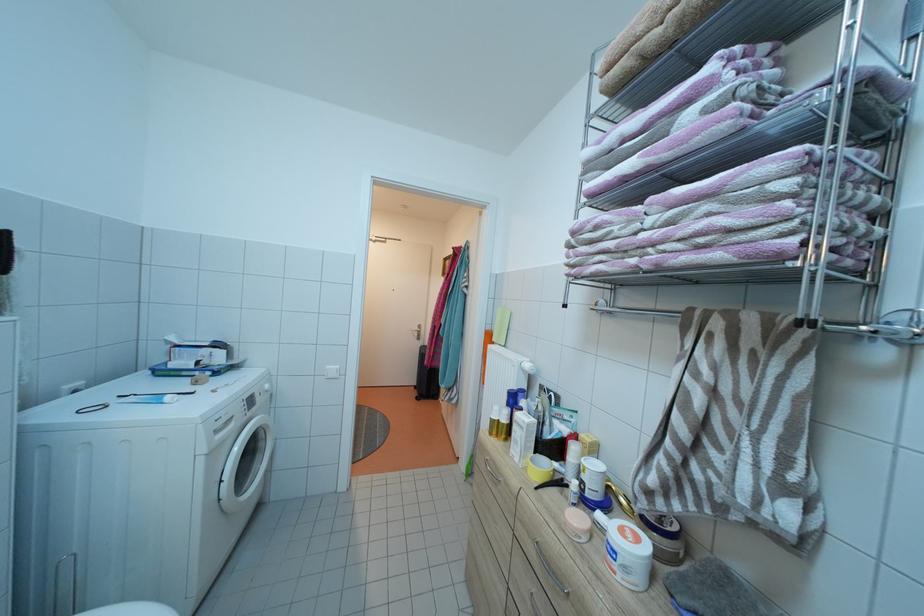
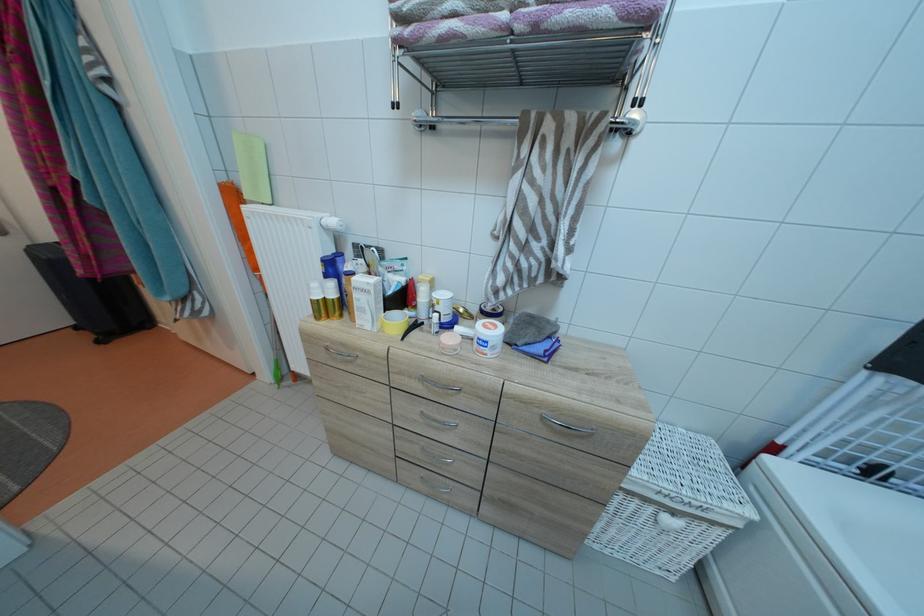
In the second image, find the point that corresponds to point 504,413 in the first image.

(322, 291)